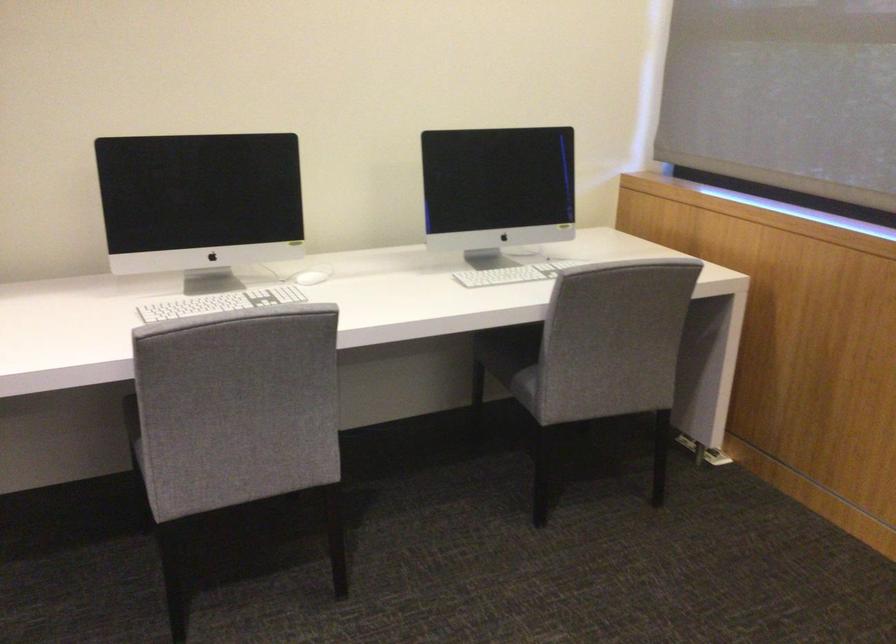
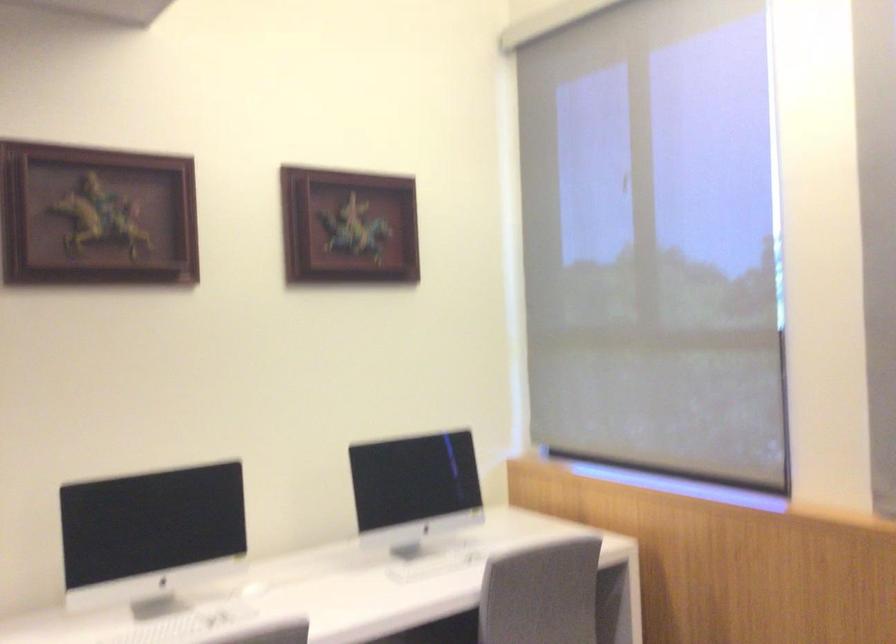
Question: The images are taken continuously from a first-person perspective. In which direction is your viewpoint rotating?

Choices:
 (A) Left
 (B) Right
 (C) Up
 (D) Down

Answer: (C)